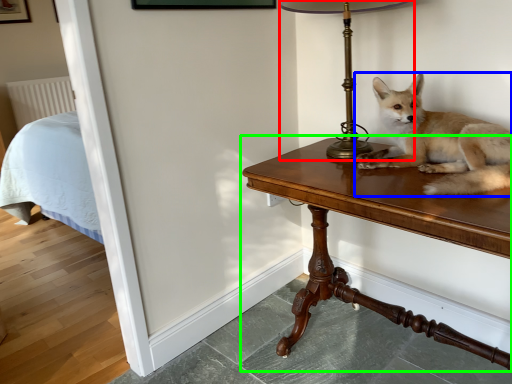
Question: Which is nearer to the table lamp (highlighted by a red box)? dog (highlighted by a blue box) or table (highlighted by a green box).

Choices:
 (A) dog
 (B) table

Answer: (A)